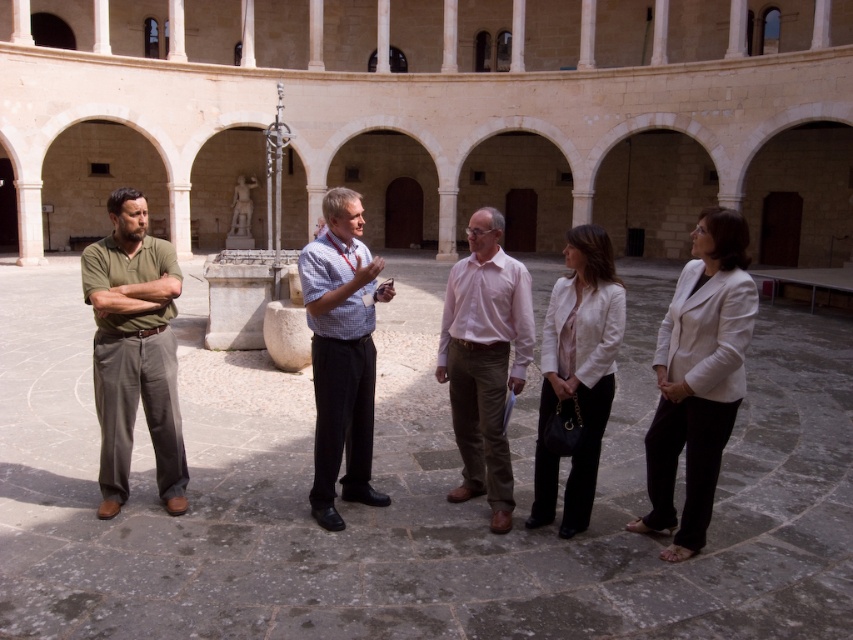
Question: Which of the following is the closest to the observer?

Choices:
 (A) pink cotton shirt at center
 (B) checkered shirt at center

Answer: (B)

Question: Which object is the farthest from the checkered shirt at center?

Choices:
 (A) matte green shirt at left
 (B) pink cotton shirt at center

Answer: (A)

Question: Based on their relative distances, which object is farther from the matte green shirt at left?

Choices:
 (A) pink cotton shirt at center
 (B) checkered shirt at center

Answer: (A)

Question: Is matte green shirt at left above checkered shirt at center?

Choices:
 (A) no
 (B) yes

Answer: (B)

Question: Can you confirm if pink cotton shirt at center is thinner than checkered shirt at center?

Choices:
 (A) no
 (B) yes

Answer: (B)

Question: Does matte green shirt at left appear on the right side of pink cotton shirt at center?

Choices:
 (A) no
 (B) yes

Answer: (A)